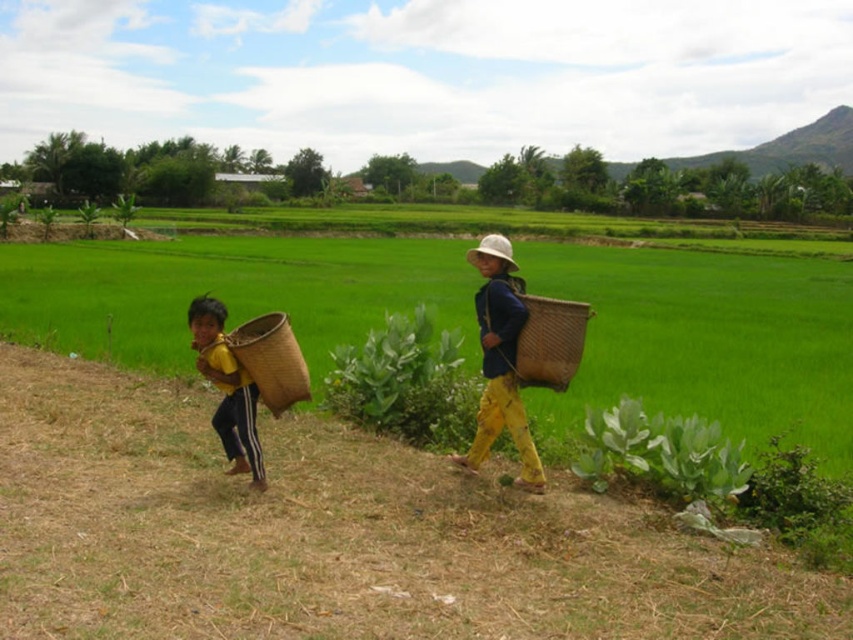
You are a photographer trying to capture the scene with the matte wicker basket at right and the white straw hat at center. Which object is closer to the camera based on their positions?

The white straw hat at center is closer to the camera because the matte wicker basket at right is positioned under it, indicating it is behind the hat.

You are a photographer trying to capture a photo of the matte wicker basket at right and the white straw hat at center. If you want to ensure both objects are clearly visible in your shot, which object should you focus on first to account for their sizes?

The matte wicker basket at right is smaller than the white straw hat at center, so you should focus on the matte wicker basket at right first to ensure its details are captured clearly before adjusting for the larger white straw hat at center.

You are standing at the center of the image and want to place a new object at the same 2D location as the matte wicker basket at right. What are the coordinates you should use?

The coordinates for the matte wicker basket at right are at point [500,362], so you should use those coordinates to place the new object at the same 2D location.